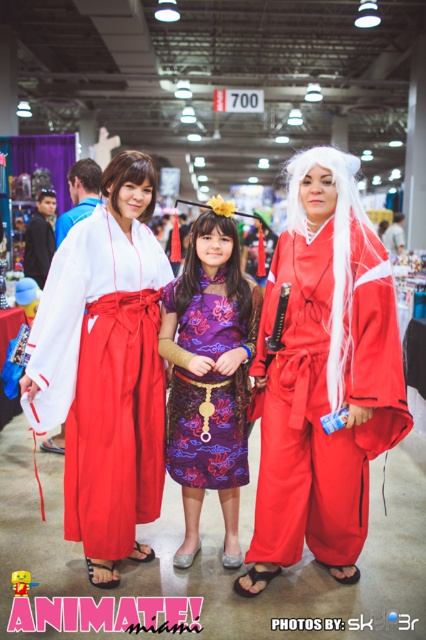
You are organizing a photo shoot for a fashion magazine and need to arrange two kimonos in the foreground of the Animate Miami convention scene. The kimonos are the matte red kimono at center and the white satin kimono at center. Which kimono should be placed closer to the camera to ensure both are visible in the frame without overlapping?

The matte red kimono at center is bigger than the white satin kimono at center, so placing the smaller white satin kimono at center closer to the camera will allow both to fit within the frame without overlapping.

What is the object located at the coordinates point (324, 376) in the image?

The object located at point (324, 376) is the matte red kimono at center.

What is located at the coordinates point (106, 369) in the image?

The point (106, 369) indicates the white cotton kimono at center.